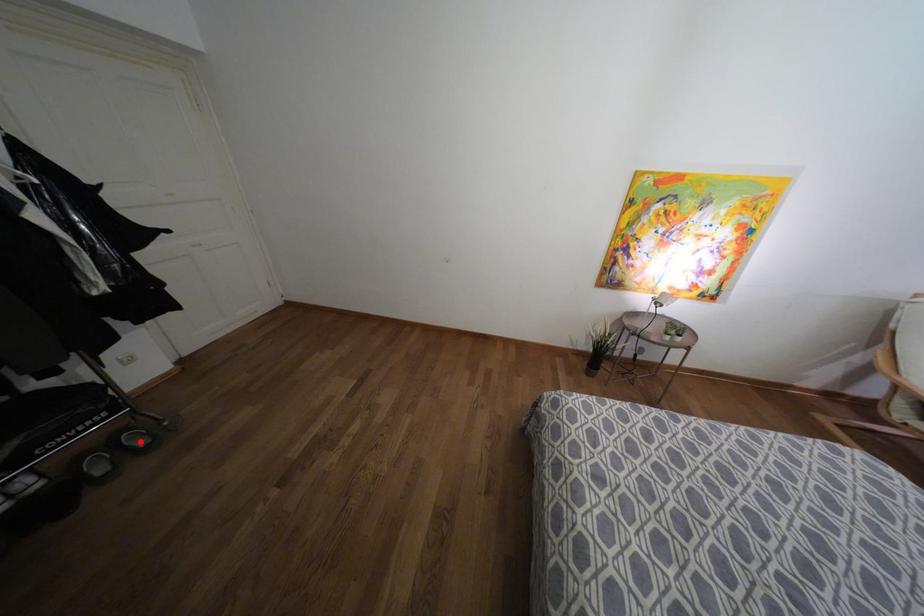
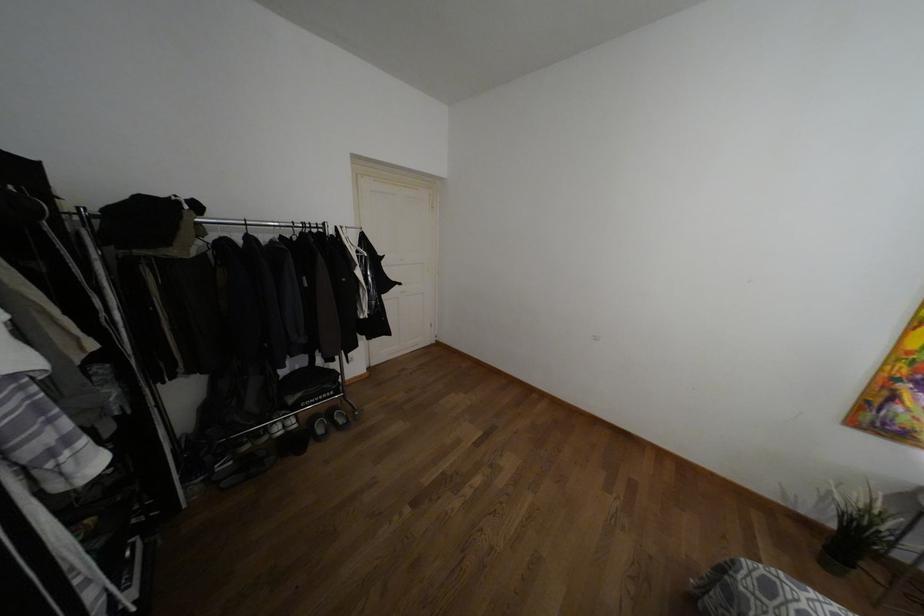
Locate, in the second image, the point that corresponds to the highlighted location in the first image.

(341, 419)